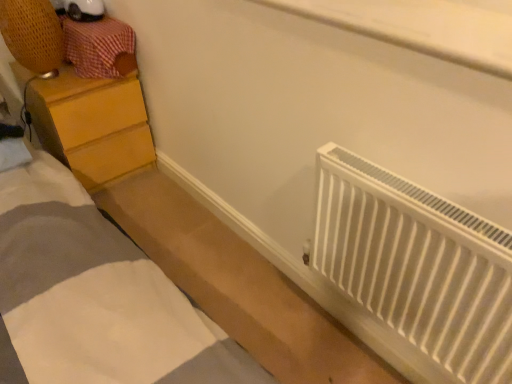
At what (x,y) coordinates should I click in order to perform the action: click on wooden chest of drawers at left. Please return your answer as a coordinate pair (x, y). This screenshot has width=512, height=384. Looking at the image, I should click on (92, 125).

This screenshot has height=384, width=512. Describe the element at coordinates (100, 47) in the screenshot. I see `wooden drawer at upper left` at that location.

What do you see at coordinates (415, 271) in the screenshot? This screenshot has height=384, width=512. I see `white plastic radiator at lower right` at bounding box center [415, 271].

In order to face white plastic radiator at lower right, should I rotate leftwards or rightwards?

A 18.855 degree turn to the right will do.

Identify the location of wooden chest of drawers at left. Image resolution: width=512 pixels, height=384 pixels. (92, 125).

From a real-world perspective, is wooden drawer at upper left under wooden chest of drawers at left?

No.

Considering the relative sizes of wooden drawer at upper left and wooden chest of drawers at left in the image provided, is wooden drawer at upper left smaller than wooden chest of drawers at left?

Correct, wooden drawer at upper left occupies less space than wooden chest of drawers at left.

Is point (97, 24) closer to viewer compared to point (105, 118)?

Yes, point (97, 24) is closer to viewer.

From the image's perspective, is wooden drawer at upper left below wooden chest of drawers at left?

No, from the image's perspective, wooden drawer at upper left is not below wooden chest of drawers at left.

How many degrees apart are the facing directions of wooden chest of drawers at left and wooden drawer at upper left?

The angle between the facing direction of wooden chest of drawers at left and the facing direction of wooden drawer at upper left is 0.00143 degrees.

Considering the sizes of wooden chest of drawers at left and wooden drawer at upper left in the image, is wooden chest of drawers at left wider or thinner than wooden drawer at upper left?

Clearly, wooden chest of drawers at left has more width compared to wooden drawer at upper left.

From a real-world perspective, between wooden chest of drawers at left and wooden drawer at upper left, who is vertically lower?

From a 3D spatial view, wooden chest of drawers at left is below.

At what (x,y) coordinates should I click in order to perform the action: click on the chest of drawers that appears behind the wooden drawer at upper left. Please return your answer as a coordinate pair (x, y). Looking at the image, I should click on (92, 125).

Between wooden drawer at upper left and white matte bed at lower right, which one appears on the right side from the viewer's perspective?

white matte bed at lower right is more to the right.

Is wooden drawer at upper left closer to camera compared to white matte bed at lower right?

No, wooden drawer at upper left is further to the viewer.

How many degrees apart are the facing directions of wooden drawer at upper left and white matte bed at lower right?

The facing directions of wooden drawer at upper left and white matte bed at lower right are 89.7 degrees apart.

Is point (99, 55) farther from viewer compared to point (192, 353)?

Yes.

From the image's perspective, which one is positioned higher, wooden chest of drawers at left or white matte bed at lower right?

wooden chest of drawers at left is shown above in the image.

In terms of size, does wooden chest of drawers at left appear bigger or smaller than white matte bed at lower right?

wooden chest of drawers at left is bigger than white matte bed at lower right.

Does wooden chest of drawers at left have a lesser width compared to white matte bed at lower right?

Indeed, wooden chest of drawers at left has a lesser width compared to white matte bed at lower right.

Who is shorter, white matte bed at lower right or white plastic radiator at lower right?

white matte bed at lower right.

Is white matte bed at lower right closer to the viewer compared to white plastic radiator at lower right?

No.

Is white matte bed at lower right looking in the opposite direction of white plastic radiator at lower right?

white matte bed at lower right does not have its back to white plastic radiator at lower right.

In terms of size, does white matte bed at lower right appear bigger or smaller than white plastic radiator at lower right?

Considering their sizes, white matte bed at lower right takes up more space than white plastic radiator at lower right.

How many degrees apart are the facing directions of white plastic radiator at lower right and white matte bed at lower right?

The facing directions of white plastic radiator at lower right and white matte bed at lower right are 180 degrees apart.

From a real-world perspective, is white plastic radiator at lower right positioned under white matte bed at lower right based on gravity?

No.

Can you confirm if white plastic radiator at lower right is positioned to the left of white matte bed at lower right?

In fact, white plastic radiator at lower right is to the right of white matte bed at lower right.

Where is `radiator that appears in front of the white matte bed at lower right`? radiator that appears in front of the white matte bed at lower right is located at coordinates (415, 271).

Which object is more forward, white matte bed at lower right or wooden chest of drawers at left?

Positioned in front is white matte bed at lower right.

Does white matte bed at lower right turn towards wooden chest of drawers at left?

No.

In the scene shown: From a real-world perspective, is white matte bed at lower right located higher than wooden chest of drawers at left?

No, from a real-world perspective, white matte bed at lower right is not over wooden chest of drawers at left

Which is farther, (69, 189) or (137, 89)?

The point (137, 89) is more distant.

What are the coordinates of `drawer above the wooden chest of drawers at left (from a real-world perspective)` in the screenshot? It's located at (100, 47).

Where is `chest of drawers behind the wooden drawer at upper left`? chest of drawers behind the wooden drawer at upper left is located at coordinates (92, 125).

When comparing their distances from white plastic radiator at lower right, does wooden drawer at upper left or wooden chest of drawers at left seem further?

The object further to white plastic radiator at lower right is wooden chest of drawers at left.

Which object lies nearer to the anchor point white matte bed at lower right, white plastic radiator at lower right or wooden drawer at upper left?

white plastic radiator at lower right.

Which object lies further to the anchor point white matte bed at lower right, wooden chest of drawers at left or white plastic radiator at lower right?

white plastic radiator at lower right is positioned further to the anchor white matte bed at lower right.

From the image, which object appears to be nearer to wooden chest of drawers at left, wooden drawer at upper left or white matte bed at lower right?

wooden drawer at upper left.

Looking at the image, which one is located closer to white matte bed at lower right, wooden drawer at upper left or wooden chest of drawers at left?

wooden chest of drawers at left is closer to white matte bed at lower right.

Considering their positions, is wooden chest of drawers at left positioned closer to white plastic radiator at lower right than wooden drawer at upper left?

The object closer to white plastic radiator at lower right is wooden drawer at upper left.

Considering their positions, is white plastic radiator at lower right positioned closer to wooden chest of drawers at left than wooden drawer at upper left?

wooden drawer at upper left lies closer to wooden chest of drawers at left than the other object.

When comparing their distances from white matte bed at lower right, does wooden drawer at upper left or white plastic radiator at lower right seem further?

The object further to white matte bed at lower right is wooden drawer at upper left.

Image resolution: width=512 pixels, height=384 pixels. I want to click on bed between wooden chest of drawers at left and white plastic radiator at lower right in the horizontal direction, so click(96, 296).

At what (x,y) coordinates should I click in order to perform the action: click on bed situated between wooden drawer at upper left and white plastic radiator at lower right from left to right. Please return your answer as a coordinate pair (x, y). This screenshot has height=384, width=512. Looking at the image, I should click on (96, 296).

Locate an element on the screen. The height and width of the screenshot is (384, 512). drawer between wooden chest of drawers at left and white plastic radiator at lower right in the horizontal direction is located at coordinates point(100,47).

In order to click on the chest of drawers that lies between wooden drawer at upper left and white matte bed at lower right from top to bottom in this screenshot , I will do `click(92, 125)`.